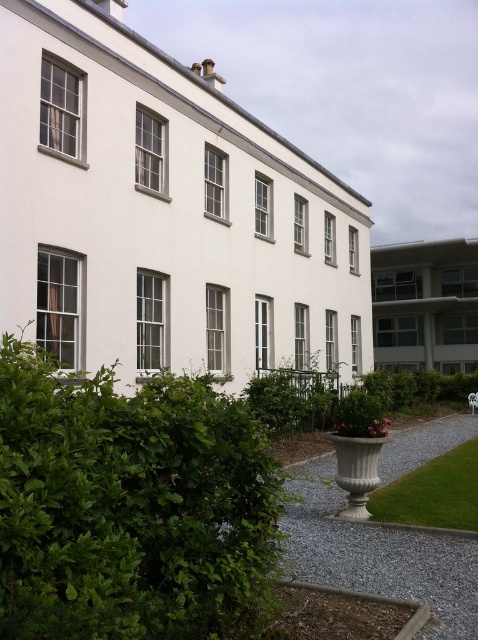
Does point (13, 368) come closer to viewer compared to point (435, 493)?

That is True.

Who is positioned more to the left, green leafy hedge at lower left or green grass at lower right?

green leafy hedge at lower left

Who is more distant from viewer, (136, 504) or (456, 481)?

Point (456, 481)

Where is `green leafy hedge at lower left`? green leafy hedge at lower left is located at coordinates (131, 508).